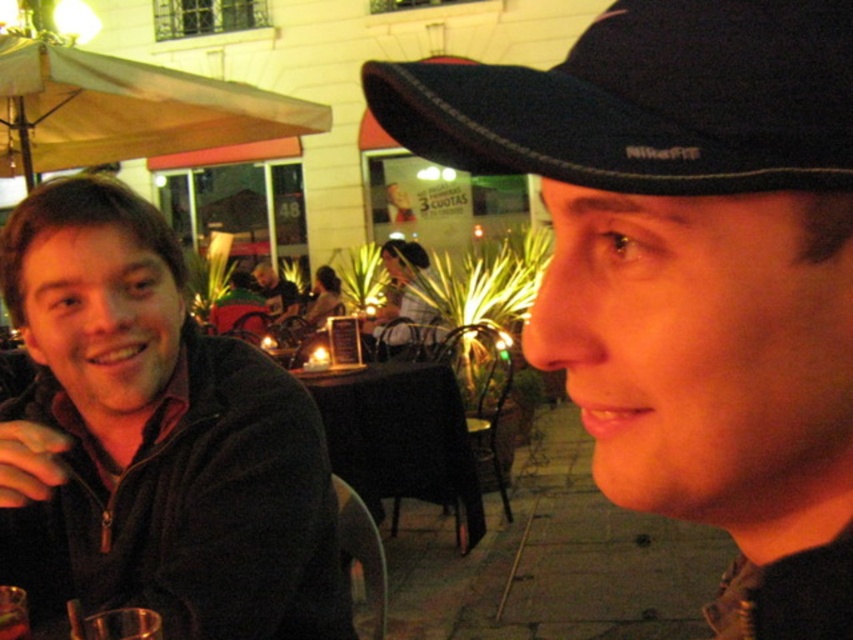
You are a waiter at the restaurant and need to deliver a drink to the table. The black nikefit cap at upper right and clear glass at lower left are on the table. Which object is blocking the glass from being easily accessed?

Result: The black nikefit cap at upper right is positioned over clear glass at lower left, so it is blocking the glass from being easily accessed.

You are a photographer setting up for an event and need to position a large camera tripod between the matte black jacket at left and the dark brown leather jacket at center. Given their sizes, will the tripod fit comfortably without overlapping either jacket?

The matte black jacket at left occupies less space than the dark brown leather jacket at center. Therefore, the tripod should be placed closer to the matte black jacket at left to ensure sufficient space between both jackets for the tripod to fit comfortably.

You are a photographer trying to capture a candid shot of both the matte black jacket at left and the dark brown leather jacket at center. Since you want to include both in the frame, which direction should you position your camera relative to the subjects?

The matte black jacket at left is to the left of the dark brown leather jacket at center, so you should position your camera to the left side of the subjects to include both in the frame.